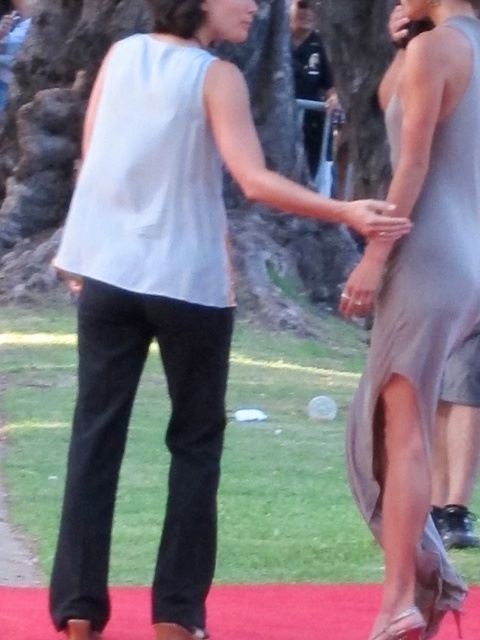
You are a GUI agent. You are given a task and a screenshot of the screen. Output one action in this format:
    pyautogui.click(x=<x>, y=<y>)
    Task: Click on the dark blue uniform at upper center
    This screenshot has width=480, height=640.
    Given the screenshot: What is the action you would take?
    pyautogui.click(x=310, y=58)

Is dark blue uniform at upper center in front of satin silver dress at center?

No, it is behind satin silver dress at center.

Is point (302, 24) positioned behind point (354, 224)?

Yes, it is.

At what (x,y) coordinates should I click in order to perform the action: click on dark blue uniform at upper center. Please return your answer as a coordinate pair (x, y). The image size is (480, 640). Looking at the image, I should click on (310, 58).

Consider the image. Is satin gray dress at right above dark blue uniform at upper center?

No.

Is point (387, 611) farther from viewer compared to point (313, 74)?

That is False.

Where is `satin gray dress at right`? This screenshot has height=640, width=480. satin gray dress at right is located at coordinates (418, 307).

Who is positioned more to the left, satin gray dress at right or satin silver dress at center?

satin silver dress at center is more to the left.

How much distance is there between satin gray dress at right and satin silver dress at center?

31.49 inches

Is point (415, 419) in front of point (365, 202)?

No.

Where is `satin gray dress at right`? The height and width of the screenshot is (640, 480). satin gray dress at right is located at coordinates (418, 307).